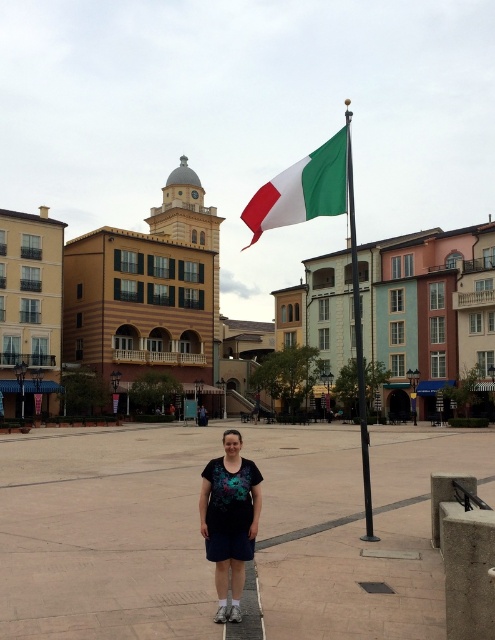
Question: Which of the following is the closest to the observer?

Choices:
 (A) (357, 582)
 (B) (207, 509)

Answer: (B)

Question: Is white-green fabric flag at upper center positioned behind green matte flagpole at center?

Choices:
 (A) yes
 (B) no

Answer: (A)

Question: Is dark blue cotton dress at center wider than green matte flagpole at center?

Choices:
 (A) no
 (B) yes

Answer: (A)

Question: Does green matte flagpole at center appear on the right side of black metal square at center?

Choices:
 (A) no
 (B) yes

Answer: (B)

Question: Which point is closer to the camera?

Choices:
 (A) (380, 580)
 (B) (226, 486)

Answer: (B)

Question: Which point appears farthest from the camera in this image?

Choices:
 (A) (380, 580)
 (B) (317, 172)
 (C) (256, 508)

Answer: (B)